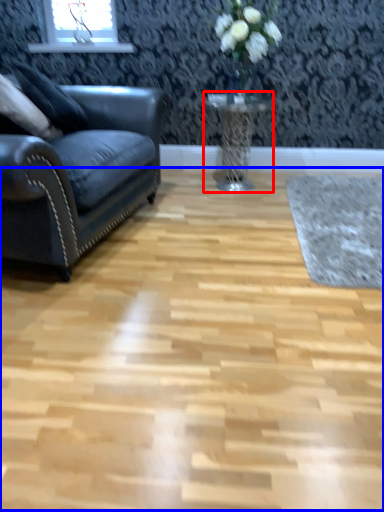
Question: Which point is further to the camera, table (highlighted by a red box) or plain (highlighted by a blue box)?

Choices:
 (A) table
 (B) plain

Answer: (A)